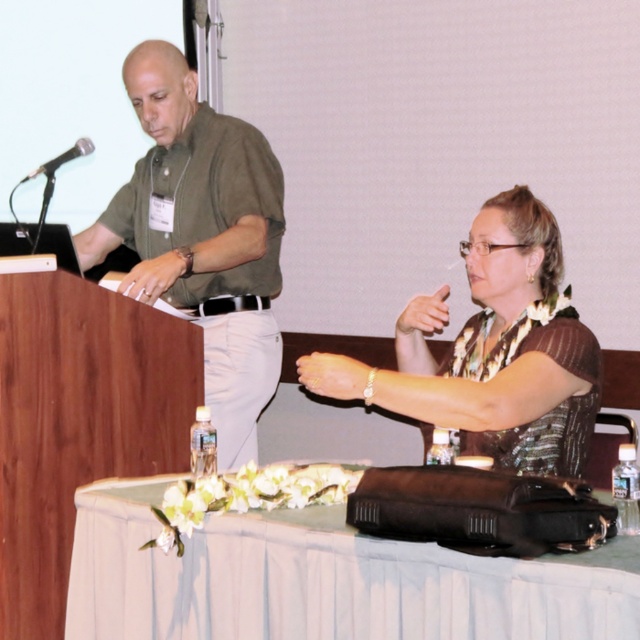
Who is more forward, (170, 179) or (61, 161)?

Point (61, 161) is more forward.

How distant is green matte shirt at left from black metallic microphone at left?

green matte shirt at left is 15.71 inches away from black metallic microphone at left.

Does point (256, 365) come farther from viewer compared to point (54, 156)?

No, it is in front of (54, 156).

Where is `green matte shirt at left`? The image size is (640, 640). green matte shirt at left is located at coordinates (202, 236).

Between point (99, 628) and point (173, 115), which one is positioned behind?

Positioned behind is point (173, 115).

Does white clothed table at lower center appear on the left side of green matte shirt at left?

In fact, white clothed table at lower center is to the right of green matte shirt at left.

Image resolution: width=640 pixels, height=640 pixels. Identify the location of white clothed table at lower center. (323, 579).

Locate an element on the screen. The image size is (640, 640). white clothed table at lower center is located at coordinates (323, 579).

Who is positioned more to the right, brown textured blouse at center or black metallic microphone at left?

brown textured blouse at center

Does brown textured blouse at center have a greater height compared to black metallic microphone at left?

Correct, brown textured blouse at center is much taller as black metallic microphone at left.

Who is more distant from viewer, (538, 369) or (86, 147)?

The point (86, 147) is more distant.

The width and height of the screenshot is (640, 640). I want to click on brown textured blouse at center, so click(492, 352).